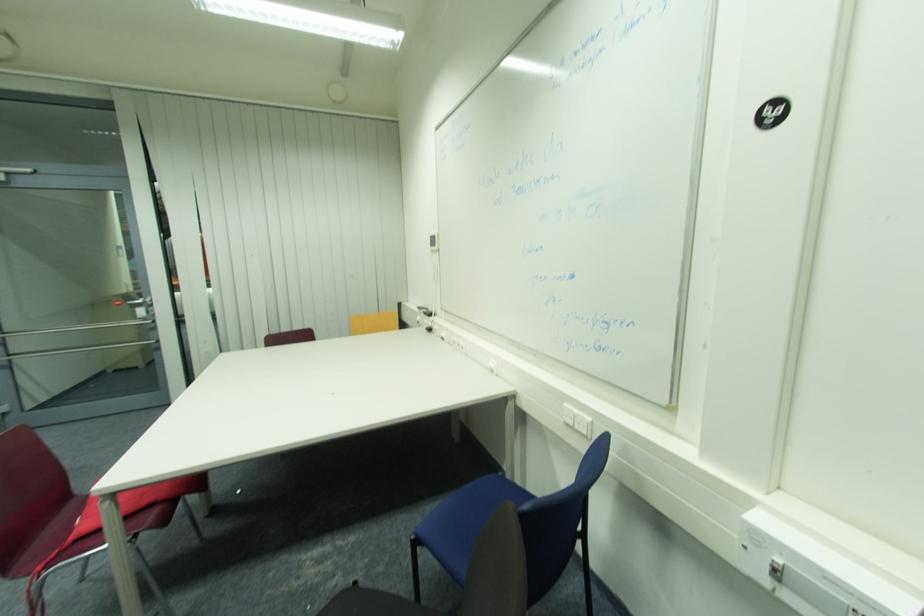
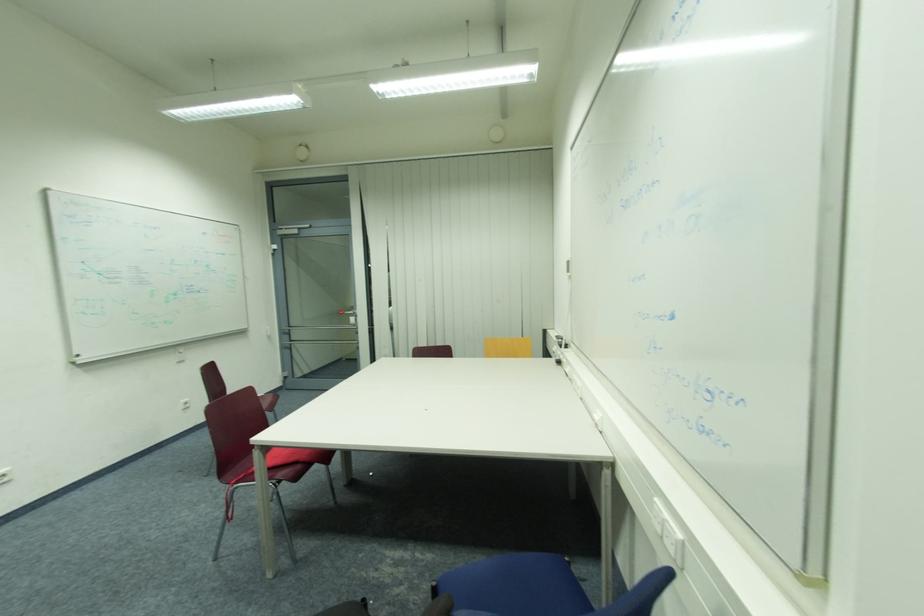
In the second image, find the point that corresponds to point 445,318 in the first image.

(578, 352)